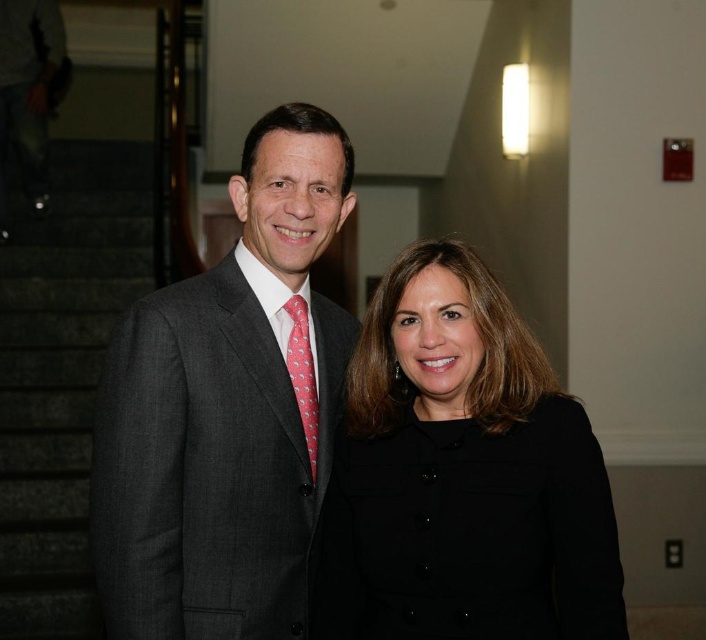
You are organizing a coat rack and a tie rack in a small closet. The coat rack can only hold items up to the size of the pink silk tie at center. Can the black matte coat at center fit on the coat rack?

The black matte coat at center is bigger than the pink silk tie at center, so it cannot fit on the coat rack designed for items up to the size of the pink silk tie at center.

Looking at this image, you are at a formal event and need to find the person wearing the matte gray suit at center. Based on the scene description, where would you look relative to the person in the black matte coat at center?

The matte gray suit at center is to the left of the black matte coat at center, so you should look to the left side of the person wearing the black matte coat at center to find the person in the matte gray suit at center.

You are a photographer at a formal event. You need to position two subjects so that one is in front of the other without blocking their face. The subjects are wearing the matte gray suit at center and the black matte coat at center. Which subject should you place closer to the camera to achieve this?

The matte gray suit at center should be placed closer to the camera since it is already positioned in front of the black matte coat at center, allowing it to be visible without blocking the face of the person in the black matte coat at center.